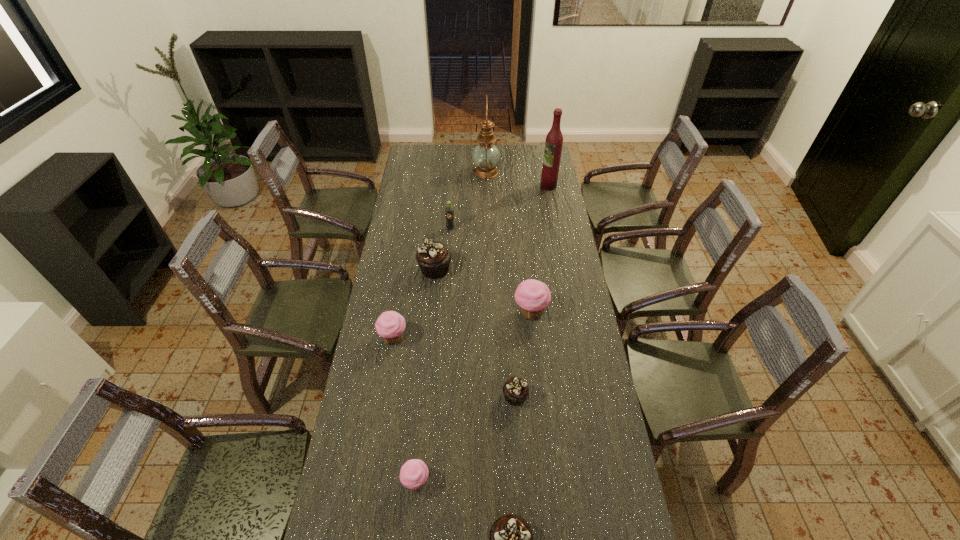
In the image, there is a desktop. Where is `blank space at the right edge`? The width and height of the screenshot is (960, 540). blank space at the right edge is located at coordinates (567, 229).

The width and height of the screenshot is (960, 540). What are the coordinates of `vacant area at the far left corner` in the screenshot? It's located at (436, 146).

The width and height of the screenshot is (960, 540). In order to click on vacant space that's between the oil lamp and the smallest brown cupcake in this screenshot , I will do `click(500, 284)`.

You are a GUI agent. You are given a task and a screenshot of the screen. Output one action in this format:
    pyautogui.click(x=<x>, y=<y>)
    Task: Click on the free area in between the leftmost cupcake and the farthest cupcake
    The image size is (960, 540).
    Given the screenshot: What is the action you would take?
    pyautogui.click(x=414, y=303)

This screenshot has width=960, height=540. I want to click on vacant area between the second nearest object and the third nearest cupcake, so click(466, 439).

You are a GUI agent. You are given a task and a screenshot of the screen. Output one action in this format:
    pyautogui.click(x=<x>, y=<y>)
    Task: Click on the free space between the eighth farthest object and the farthest cupcake
    The image size is (960, 540).
    Given the screenshot: What is the action you would take?
    pos(425,375)

Image resolution: width=960 pixels, height=540 pixels. Identify the location of free point between the second smallest pink cupcake and the smallest pink cupcake. (405, 410).

Image resolution: width=960 pixels, height=540 pixels. Identify the location of free space between the nearest pink cupcake and the fourth farthest object. (425, 375).

Identify the location of object that is the second closest to the nearest brown cupcake. This screenshot has height=540, width=960. (515, 390).

Point out which object is positioned as the eighth nearest to the rightmost pink cupcake. Please provide its 2D coordinates. Your answer should be formatted as a tuple, i.e. [(x, y)], where the tuple contains the x and y coordinates of a point satisfying the conditions above.

[(485, 155)]